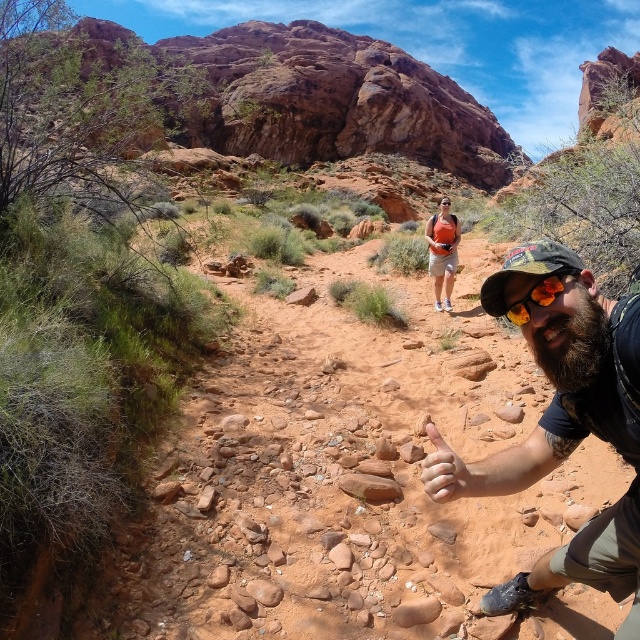
Question: Is bearded man at center thinner than orange reflective goggles at center?

Choices:
 (A) no
 (B) yes

Answer: (A)

Question: Which of these objects is positioned closest to the orange reflective goggles at center?

Choices:
 (A) bearded man at center
 (B) orange backpack at center

Answer: (A)

Question: Is bearded man at center behind orange backpack at center?

Choices:
 (A) no
 (B) yes

Answer: (A)

Question: Can you confirm if bearded man at center is positioned above orange backpack at center?

Choices:
 (A) no
 (B) yes

Answer: (A)

Question: Among these objects, which one is farthest from the camera?

Choices:
 (A) bearded man at center
 (B) orange reflective goggles at center
 (C) orange backpack at center

Answer: (C)

Question: Which point is closer to the camera?

Choices:
 (A) (609, 310)
 (B) (452, 237)

Answer: (A)